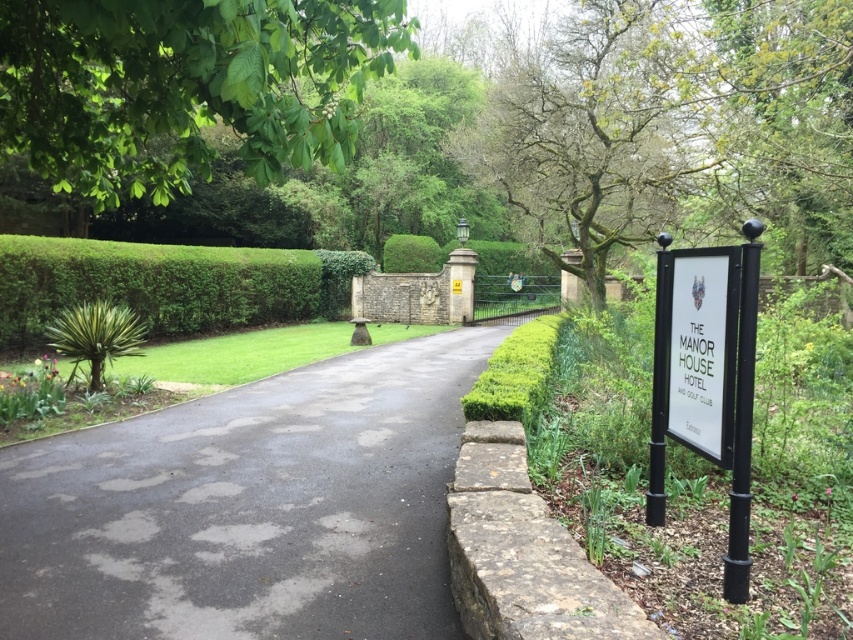
The height and width of the screenshot is (640, 853). I want to click on dark gray asphalt at center, so click(x=248, y=508).

Consider the image. Can you confirm if dark gray asphalt at center is positioned below white paper sign at right?

Yes.

Does point (186, 616) lie in front of point (714, 435)?

No, it is behind (714, 435).

Image resolution: width=853 pixels, height=640 pixels. I want to click on dark gray asphalt at center, so click(248, 508).

Does green leafy tree at upper left lie in front of white paper sign at right?

Yes.

The height and width of the screenshot is (640, 853). In order to click on green leafy tree at upper left in this screenshot , I will do `click(186, 86)`.

Identify the location of green leafy tree at upper left. (186, 86).

Does point (360, 627) come farther from viewer compared to point (199, 301)?

No.

Does dark gray asphalt at center have a greater height compared to green leafy hedge at center?

No, dark gray asphalt at center is not taller than green leafy hedge at center.

You are a GUI agent. You are given a task and a screenshot of the screen. Output one action in this format:
    pyautogui.click(x=<x>, y=<y>)
    Task: Click on the dark gray asphalt at center
    
    Given the screenshot: What is the action you would take?
    pyautogui.click(x=248, y=508)